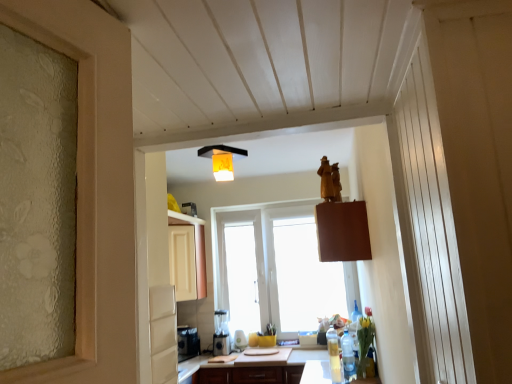
Question: Does clear plastic bottle at lower right, acting as the 1th bottle starting from the front, have a lesser width compared to translucent plastic bottle at lower right, arranged as the second bottle when viewed from the front?

Choices:
 (A) yes
 (B) no

Answer: (B)

Question: Could you tell me if clear plastic bottle at lower right, acting as the 1th bottle starting from the front, is facing translucent plastic bottle at lower right, which is counted as the first bottle, starting from the back?

Choices:
 (A) yes
 (B) no

Answer: (B)

Question: Is the depth of clear plastic bottle at lower right, acting as the 1th bottle starting from the front, less than that of translucent plastic bottle at lower right, which is counted as the first bottle, starting from the back?

Choices:
 (A) yes
 (B) no

Answer: (A)

Question: Does clear plastic bottle at lower right, acting as the 1th bottle starting from the front, have a greater height compared to translucent plastic bottle at lower right, arranged as the second bottle when viewed from the front?

Choices:
 (A) no
 (B) yes

Answer: (B)

Question: Does clear plastic bottle at lower right, which ranks as the second bottle in back-to-front order, have a larger size compared to translucent plastic bottle at lower right, arranged as the second bottle when viewed from the front?

Choices:
 (A) no
 (B) yes

Answer: (A)

Question: Is translucent plastic bottle at lower right, arranged as the second bottle when viewed from the front, completely or partially inside clear plastic bottle at lower right, which ranks as the second bottle in back-to-front order?

Choices:
 (A) no
 (B) yes

Answer: (A)

Question: Considering the relative sizes of orange fabric lampshade at upper center and white matte cabinet at upper left in the image provided, is orange fabric lampshade at upper center taller than white matte cabinet at upper left?

Choices:
 (A) no
 (B) yes

Answer: (A)

Question: Can you see orange fabric lampshade at upper center touching white matte cabinet at upper left?

Choices:
 (A) yes
 (B) no

Answer: (B)

Question: Is the depth of orange fabric lampshade at upper center greater than that of white matte cabinet at upper left?

Choices:
 (A) no
 (B) yes

Answer: (A)

Question: Is orange fabric lampshade at upper center smaller than white matte cabinet at upper left?

Choices:
 (A) no
 (B) yes

Answer: (B)

Question: Would you say orange fabric lampshade at upper center contains white matte cabinet at upper left?

Choices:
 (A) no
 (B) yes

Answer: (A)

Question: Is orange fabric lampshade at upper center to the left of white matte cabinet at upper left from the viewer's perspective?

Choices:
 (A) no
 (B) yes

Answer: (A)

Question: Is white matte cabinet at upper left smaller than translucent plastic bottle at lower right, arranged as the second bottle when viewed from the front?

Choices:
 (A) yes
 (B) no

Answer: (B)